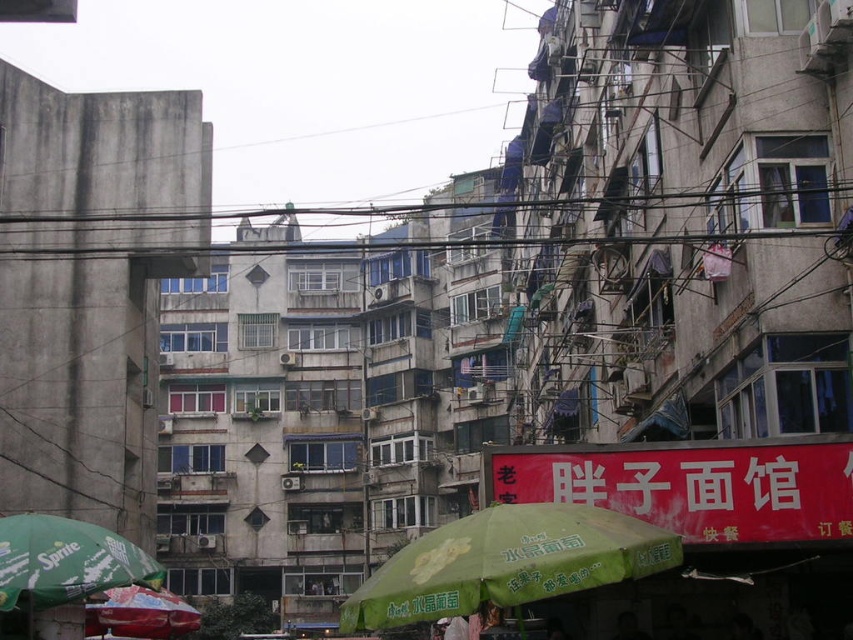
Can you confirm if green fabric umbrella at center is positioned below green fabric umbrella at lower left?

Incorrect, green fabric umbrella at center is not positioned below green fabric umbrella at lower left.

Does green fabric umbrella at center appear over green fabric umbrella at lower left?

Correct, green fabric umbrella at center is located above green fabric umbrella at lower left.

Between point (566, 548) and point (35, 525), which one is positioned behind?

The point (35, 525) is more distant.

Identify the location of green fabric umbrella at center. (508, 563).

Can you confirm if black wire at upper center is smaller than red matte umbrella at lower left?

Incorrect, black wire at upper center is not smaller in size than red matte umbrella at lower left.

Does black wire at upper center appear over red matte umbrella at lower left?

Correct, black wire at upper center is located above red matte umbrella at lower left.

What do you see at coordinates (445, 205) in the screenshot? The image size is (853, 640). I see `black wire at upper center` at bounding box center [445, 205].

Image resolution: width=853 pixels, height=640 pixels. What are the coordinates of `black wire at upper center` in the screenshot? It's located at (445, 205).

From the picture: Does black wire at upper center have a lesser height compared to green fabric umbrella at lower left?

Incorrect, black wire at upper center's height does not fall short of green fabric umbrella at lower left's.

Between point (637, 241) and point (117, 576), which one is positioned in front?

Point (117, 576) is more forward.

Find the location of `black wire at upper center`. black wire at upper center is located at coordinates (445, 205).